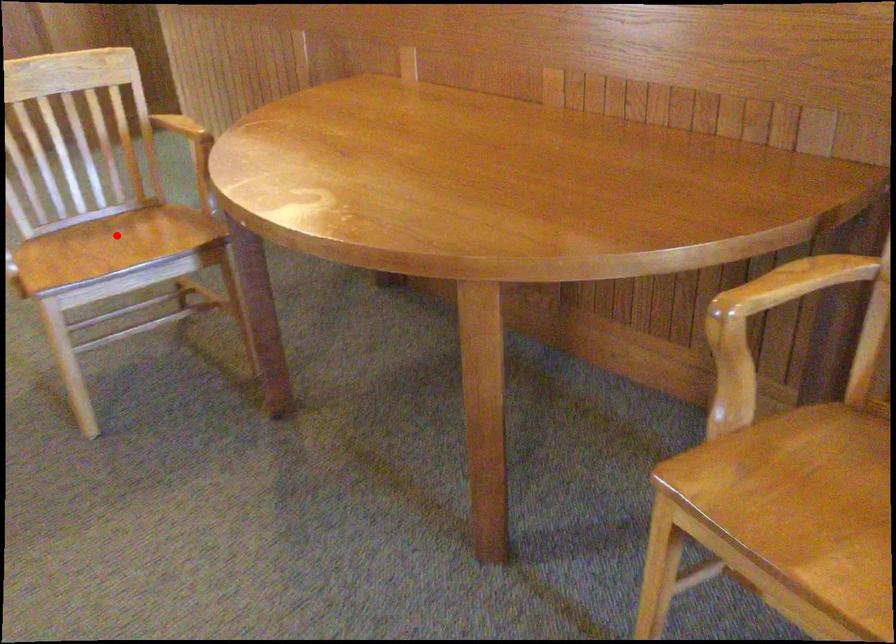
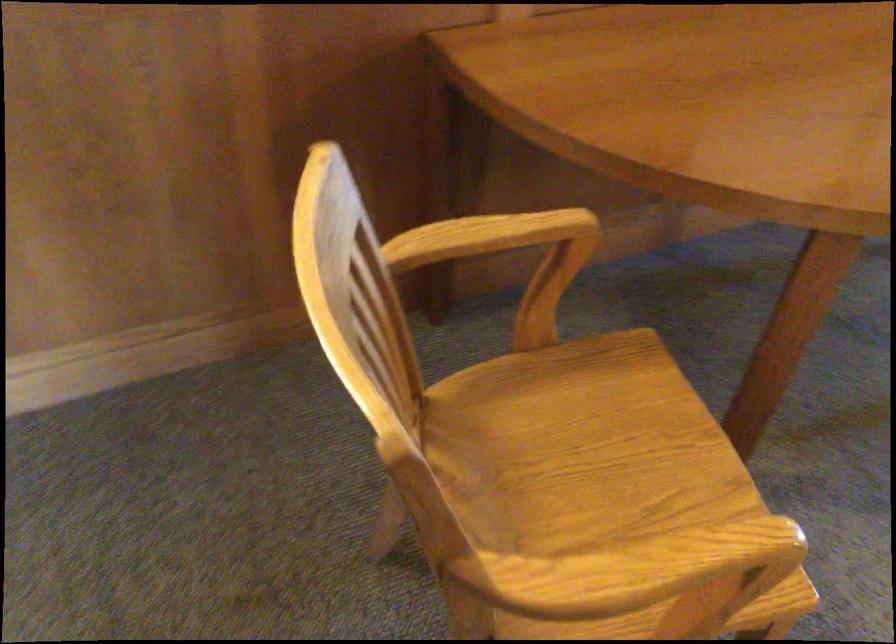
In the second image, find the point that corresponds to the highlighted location in the first image.

(574, 456)